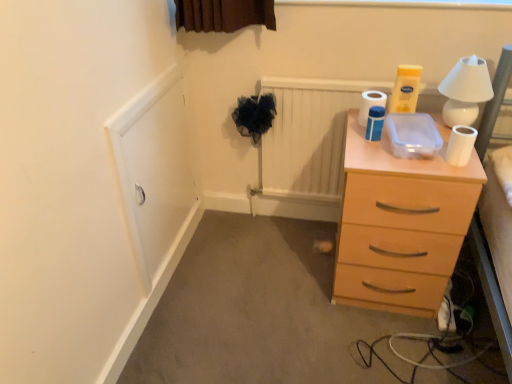
I want to click on empty space that is in between white matte toilet paper at upper right, positioned as the 1th toilet paper in right-to-left order, and white glossy toilet paper at upper right, which is the third toilet paper in front-to-back order, so click(417, 142).